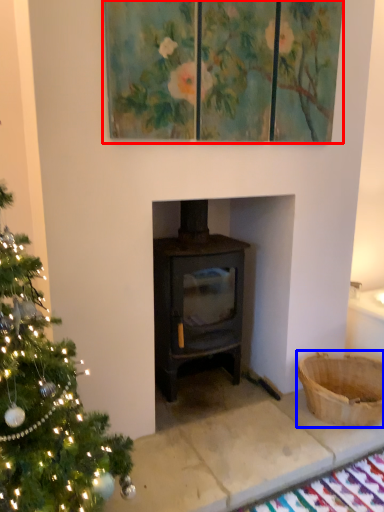
Question: Which object appears closest to the camera in this image, oil painting (highlighted by a red box) or basket (highlighted by a blue box)?

Choices:
 (A) oil painting
 (B) basket

Answer: (A)